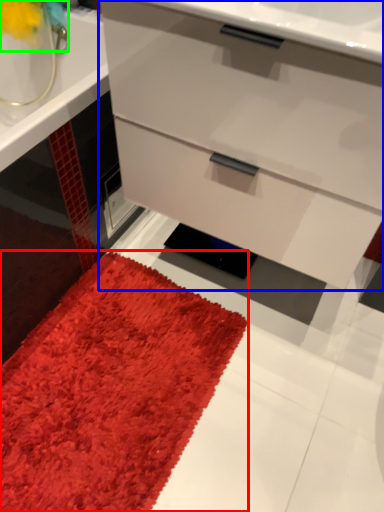
Question: Which object is the closest to the mat (highlighted by a red box)? Choose among these: chest of drawers (highlighted by a blue box) or flower (highlighted by a green box).

Choices:
 (A) chest of drawers
 (B) flower

Answer: (A)